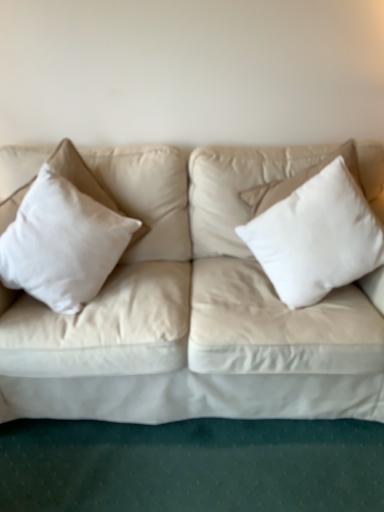
Image resolution: width=384 pixels, height=512 pixels. What do you see at coordinates (62, 243) in the screenshot?
I see `white cotton pillow at left, acting as the 2th pillow starting from the right` at bounding box center [62, 243].

Measure the distance between white cotton pillow at left, acting as the 2th pillow starting from the right, and camera.

They are 1.38 meters apart.

You are a GUI agent. You are given a task and a screenshot of the screen. Output one action in this format:
    pyautogui.click(x=<x>, y=<y>)
    Task: Click on the white cotton pillow at left, which ranks as the first pillow in left-to-right order
    The width and height of the screenshot is (384, 512).
    Given the screenshot: What is the action you would take?
    pyautogui.click(x=62, y=243)

What do you see at coordinates (316, 236) in the screenshot? I see `white soft pillow at right, positioned as the 2th pillow in left-to-right order` at bounding box center [316, 236].

Image resolution: width=384 pixels, height=512 pixels. I want to click on white soft pillow at right, placed as the 1th pillow when sorted from right to left, so 316,236.

This screenshot has width=384, height=512. What are the coordinates of `white cotton pillow at left, acting as the 2th pillow starting from the right` in the screenshot? It's located at (62, 243).

Which object is positioned more to the left, white soft pillow at right, placed as the 1th pillow when sorted from right to left, or white cotton pillow at left, acting as the 2th pillow starting from the right?

Positioned to the left is white cotton pillow at left, acting as the 2th pillow starting from the right.

Which object is more forward, white soft pillow at right, placed as the 1th pillow when sorted from right to left, or white cotton pillow at left, which ranks as the first pillow in left-to-right order?

white cotton pillow at left, which ranks as the first pillow in left-to-right order, is in front.

Does point (294, 259) appear closer or farther from the camera than point (111, 269)?

Point (294, 259) appears to be closer to the viewer than point (111, 269).

From the image's perspective, relative to white cotton pillow at left, acting as the 2th pillow starting from the right, is white soft pillow at right, placed as the 1th pillow when sorted from right to left, above or below?

white soft pillow at right, placed as the 1th pillow when sorted from right to left, is above white cotton pillow at left, acting as the 2th pillow starting from the right.

From a real-world perspective, is white soft pillow at right, placed as the 1th pillow when sorted from right to left, over white cotton pillow at left, acting as the 2th pillow starting from the right?

Correct, in the physical world, white soft pillow at right, placed as the 1th pillow when sorted from right to left, is higher than white cotton pillow at left, acting as the 2th pillow starting from the right.

In the scene shown: Between white soft pillow at right, positioned as the 2th pillow in left-to-right order, and white cotton pillow at left, acting as the 2th pillow starting from the right, which one has smaller width?

Thinner between the two is white soft pillow at right, positioned as the 2th pillow in left-to-right order.

Does white soft pillow at right, positioned as the 2th pillow in left-to-right order, have a greater height compared to white cotton pillow at left, acting as the 2th pillow starting from the right?

Yes.

Who is smaller, white soft pillow at right, positioned as the 2th pillow in left-to-right order, or white cotton pillow at left, acting as the 2th pillow starting from the right?

white cotton pillow at left, acting as the 2th pillow starting from the right.

Which is correct: white soft pillow at right, placed as the 1th pillow when sorted from right to left, is inside white cotton pillow at left, which ranks as the first pillow in left-to-right order, or outside of it?

white soft pillow at right, placed as the 1th pillow when sorted from right to left, is outside white cotton pillow at left, which ranks as the first pillow in left-to-right order.

Are white soft pillow at right, positioned as the 2th pillow in left-to-right order, and white cotton pillow at left, which ranks as the first pillow in left-to-right order, beside each other?

white soft pillow at right, positioned as the 2th pillow in left-to-right order, and white cotton pillow at left, which ranks as the first pillow in left-to-right order, are clearly separated.

Is white soft pillow at right, positioned as the 2th pillow in left-to-right order, looking in the opposite direction of white cotton pillow at left, acting as the 2th pillow starting from the right?

No, white soft pillow at right, positioned as the 2th pillow in left-to-right order,'s orientation is not away from white cotton pillow at left, acting as the 2th pillow starting from the right.

How many degrees apart are the facing directions of white soft pillow at right, placed as the 1th pillow when sorted from right to left, and white cotton pillow at left, acting as the 2th pillow starting from the right?

The angular difference between white soft pillow at right, placed as the 1th pillow when sorted from right to left, and white cotton pillow at left, acting as the 2th pillow starting from the right, is 38.8 degrees.

How far apart are white soft pillow at right, placed as the 1th pillow when sorted from right to left, and white cotton pillow at left, acting as the 2th pillow starting from the right?

white soft pillow at right, placed as the 1th pillow when sorted from right to left, and white cotton pillow at left, acting as the 2th pillow starting from the right, are 25.39 inches apart from each other.

You are a GUI agent. You are given a task and a screenshot of the screen. Output one action in this format:
    pyautogui.click(x=<x>, y=<y>)
    Task: Click on the pillow that is under the white soft pillow at right, positioned as the 2th pillow in left-to-right order (from a real-world perspective)
    This screenshot has height=512, width=384.
    Given the screenshot: What is the action you would take?
    pyautogui.click(x=62, y=243)

In the scene shown: Considering the relative positions of white cotton pillow at left, which ranks as the first pillow in left-to-right order, and white soft pillow at right, placed as the 1th pillow when sorted from right to left, in the image provided, is white cotton pillow at left, which ranks as the first pillow in left-to-right order, to the left or to the right of white soft pillow at right, placed as the 1th pillow when sorted from right to left,?

white cotton pillow at left, which ranks as the first pillow in left-to-right order, is positioned on white soft pillow at right, placed as the 1th pillow when sorted from right to left,'s left side.

Is the position of white cotton pillow at left, which ranks as the first pillow in left-to-right order, more distant than that of white soft pillow at right, positioned as the 2th pillow in left-to-right order?

No, white cotton pillow at left, which ranks as the first pillow in left-to-right order, is in front of white soft pillow at right, positioned as the 2th pillow in left-to-right order.

Which point is more forward, (29, 229) or (283, 226)?

Positioned in front is point (29, 229).

From the image's perspective, which object appears higher, white cotton pillow at left, which ranks as the first pillow in left-to-right order, or white soft pillow at right, placed as the 1th pillow when sorted from right to left?

From the image's view, white soft pillow at right, placed as the 1th pillow when sorted from right to left, is above.

From a real-world perspective, which is physically below, white cotton pillow at left, acting as the 2th pillow starting from the right, or white soft pillow at right, positioned as the 2th pillow in left-to-right order?

white cotton pillow at left, acting as the 2th pillow starting from the right, is physically lower.

Consider the image. Considering the sizes of white cotton pillow at left, acting as the 2th pillow starting from the right, and white soft pillow at right, positioned as the 2th pillow in left-to-right order, in the image, is white cotton pillow at left, acting as the 2th pillow starting from the right, wider or thinner than white soft pillow at right, positioned as the 2th pillow in left-to-right order,?

In the image, white cotton pillow at left, acting as the 2th pillow starting from the right, appears to be wider than white soft pillow at right, positioned as the 2th pillow in left-to-right order.

Can you confirm if white cotton pillow at left, which ranks as the first pillow in left-to-right order, is taller than white soft pillow at right, placed as the 1th pillow when sorted from right to left?

No.

Based on their sizes in the image, would you say white cotton pillow at left, which ranks as the first pillow in left-to-right order, is bigger or smaller than white soft pillow at right, positioned as the 2th pillow in left-to-right order?

Clearly, white cotton pillow at left, which ranks as the first pillow in left-to-right order, is smaller in size than white soft pillow at right, positioned as the 2th pillow in left-to-right order.

Which is correct: white cotton pillow at left, acting as the 2th pillow starting from the right, is inside white soft pillow at right, placed as the 1th pillow when sorted from right to left, or outside of it?

The correct answer is: outside.

Are white cotton pillow at left, acting as the 2th pillow starting from the right, and white soft pillow at right, placed as the 1th pillow when sorted from right to left, making contact?

No.

Does white cotton pillow at left, acting as the 2th pillow starting from the right, turn towards white soft pillow at right, placed as the 1th pillow when sorted from right to left?

No, white cotton pillow at left, acting as the 2th pillow starting from the right, is not oriented towards white soft pillow at right, placed as the 1th pillow when sorted from right to left.

You are a GUI agent. You are given a task and a screenshot of the screen. Output one action in this format:
    pyautogui.click(x=<x>, y=<y>)
    Task: Click on the pillow on the left of the white soft pillow at right, placed as the 1th pillow when sorted from right to left
    The image size is (384, 512).
    Given the screenshot: What is the action you would take?
    pyautogui.click(x=62, y=243)

Identify the location of pillow behind the white cotton pillow at left, acting as the 2th pillow starting from the right. Image resolution: width=384 pixels, height=512 pixels. (316, 236).

Find the location of a particular element. pillow in front of the white soft pillow at right, placed as the 1th pillow when sorted from right to left is located at coordinates (62, 243).